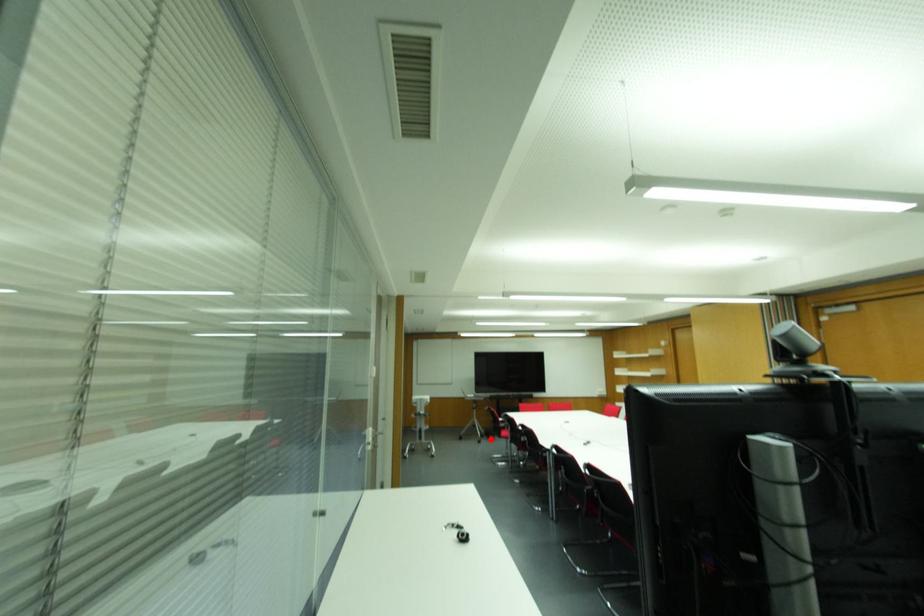
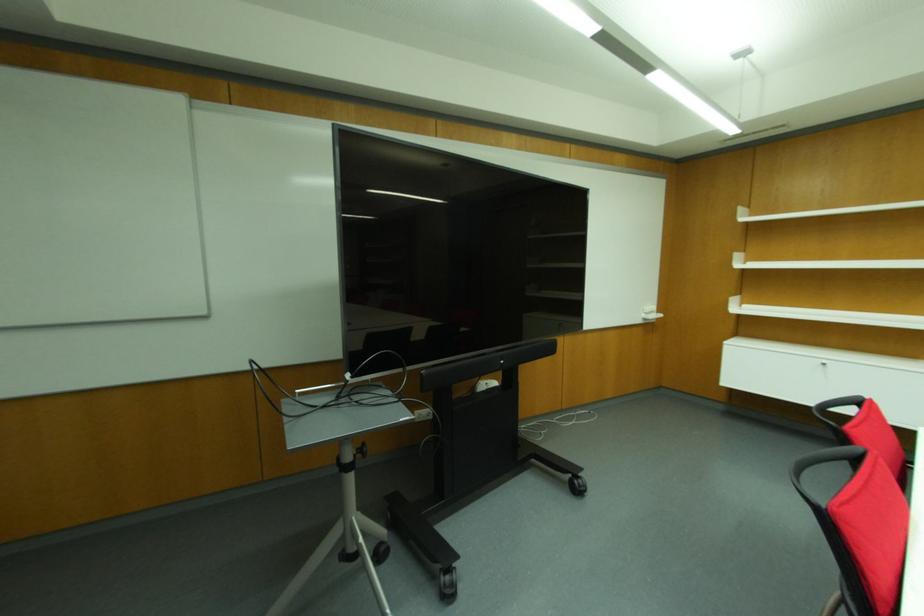
Locate, in the second image, the point that corresponds to the highlighted location in the first image.

(448, 594)